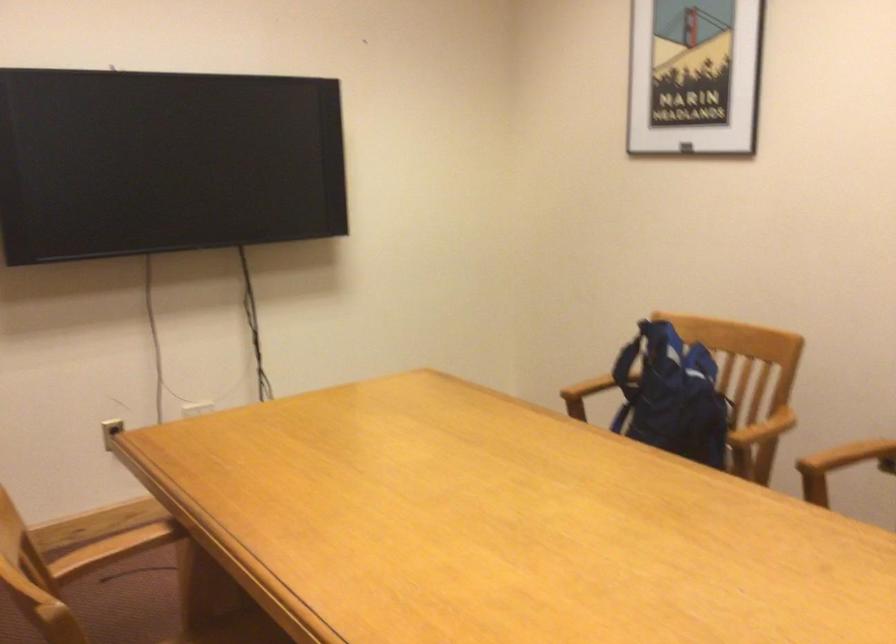
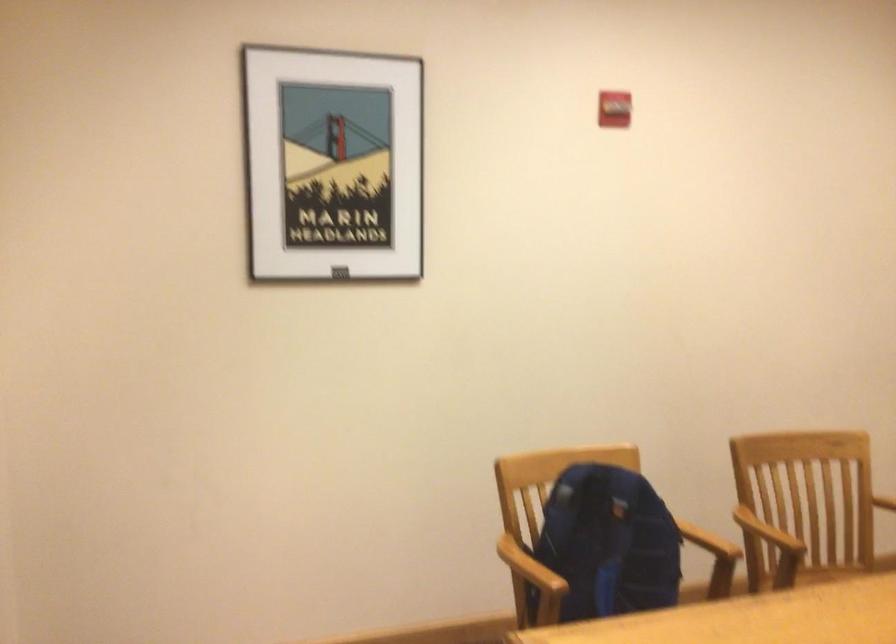
In the second image, find the point that corresponds to [595,389] in the first image.

(530, 567)